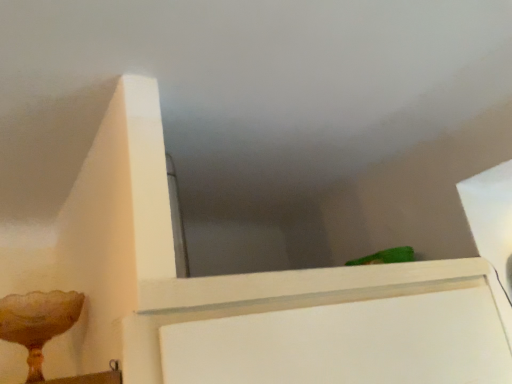
Locate an element on the screen. The width and height of the screenshot is (512, 384). amber glass at left is located at coordinates (38, 322).

What do you see at coordinates (38, 322) in the screenshot? I see `amber glass at left` at bounding box center [38, 322].

Where is `amber glass at left`? The image size is (512, 384). amber glass at left is located at coordinates (38, 322).